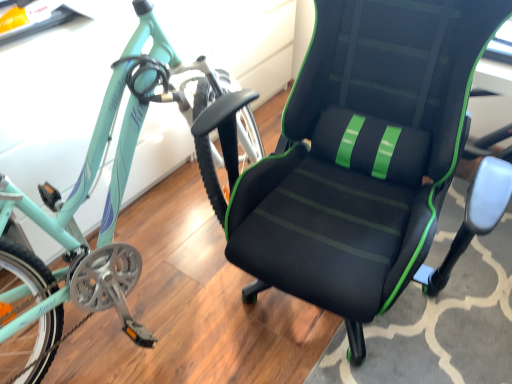
Where is `teal matte bicycle at left`? teal matte bicycle at left is located at coordinates tap(112, 202).

The image size is (512, 384). Describe the element at coordinates (112, 202) in the screenshot. I see `teal matte bicycle at left` at that location.

This screenshot has width=512, height=384. What do you see at coordinates (366, 159) in the screenshot? I see `black mesh chair at center` at bounding box center [366, 159].

Image resolution: width=512 pixels, height=384 pixels. In order to click on black mesh chair at center in this screenshot , I will do `click(366, 159)`.

Identify the location of teal matte bicycle at left. The image size is (512, 384). (112, 202).

Is teal matte bicycle at left at the right side of black mesh chair at center?

In fact, teal matte bicycle at left is to the left of black mesh chair at center.

Which object is closer to the camera, teal matte bicycle at left or black mesh chair at center?

teal matte bicycle at left is in front.

Is point (111, 249) closer or farther from the camera than point (331, 181)?

Point (111, 249) appears to be closer to the viewer than point (331, 181).

From the image's perspective, is teal matte bicycle at left located above or below black mesh chair at center?

From the image's perspective, teal matte bicycle at left appears above black mesh chair at center.

From a real-world perspective, does teal matte bicycle at left stand above black mesh chair at center?

No.

Considering the relative sizes of teal matte bicycle at left and black mesh chair at center in the image provided, is teal matte bicycle at left thinner than black mesh chair at center?

Correct, the width of teal matte bicycle at left is less than that of black mesh chair at center.

Does teal matte bicycle at left have a greater height compared to black mesh chair at center?

In fact, teal matte bicycle at left may be shorter than black mesh chair at center.

Is teal matte bicycle at left smaller than black mesh chair at center?

No.

Is teal matte bicycle at left located outside black mesh chair at center?

Yes, teal matte bicycle at left is outside of black mesh chair at center.

Can you see teal matte bicycle at left touching black mesh chair at center?

No, teal matte bicycle at left is not in contact with black mesh chair at center.

Is teal matte bicycle at left facing towards black mesh chair at center?

Yes, teal matte bicycle at left is turned towards black mesh chair at center.

How different are the orientations of teal matte bicycle at left and black mesh chair at center in degrees?

107 degrees separate the facing orientations of teal matte bicycle at left and black mesh chair at center.

Locate an element on the screen. chair behind the teal matte bicycle at left is located at coordinates (366, 159).

Is black mesh chair at center at the right side of teal matte bicycle at left?

Indeed, black mesh chair at center is positioned on the right side of teal matte bicycle at left.

Who is more distant, black mesh chair at center or teal matte bicycle at left?

black mesh chair at center is further from the camera.

Which is closer to the camera, (x=217, y=107) or (x=223, y=190)?

Point (x=217, y=107) is farther from the camera than point (x=223, y=190).

From the image's perspective, which is above, black mesh chair at center or teal matte bicycle at left?

teal matte bicycle at left, from the image's perspective.

From a real-world perspective, between black mesh chair at center and teal matte bicycle at left, who is vertically lower?

teal matte bicycle at left is physically lower.

Is black mesh chair at center wider than teal matte bicycle at left?

Indeed, black mesh chair at center has a greater width compared to teal matte bicycle at left.

Considering the sizes of objects black mesh chair at center and teal matte bicycle at left in the image provided, who is taller, black mesh chair at center or teal matte bicycle at left?

Standing taller between the two is black mesh chair at center.

Based on their sizes in the image, would you say black mesh chair at center is bigger or smaller than teal matte bicycle at left?

In the image, black mesh chair at center appears to be smaller than teal matte bicycle at left.

Choose the correct answer: Is black mesh chair at center inside teal matte bicycle at left or outside it?

black mesh chair at center cannot be found inside teal matte bicycle at left.

Is black mesh chair at center next to teal matte bicycle at left and touching it?

No, black mesh chair at center is not in contact with teal matte bicycle at left.

Is black mesh chair at center facing away from teal matte bicycle at left?

No, black mesh chair at center's orientation is not away from teal matte bicycle at left.

Locate an element on the screen. This screenshot has width=512, height=384. bicycle located above the black mesh chair at center (from the image's perspective) is located at coordinates (112, 202).

Identify the location of bicycle below the black mesh chair at center (from a real-world perspective). (112, 202).

Find the location of a particular element. bicycle in front of the black mesh chair at center is located at coordinates (112, 202).